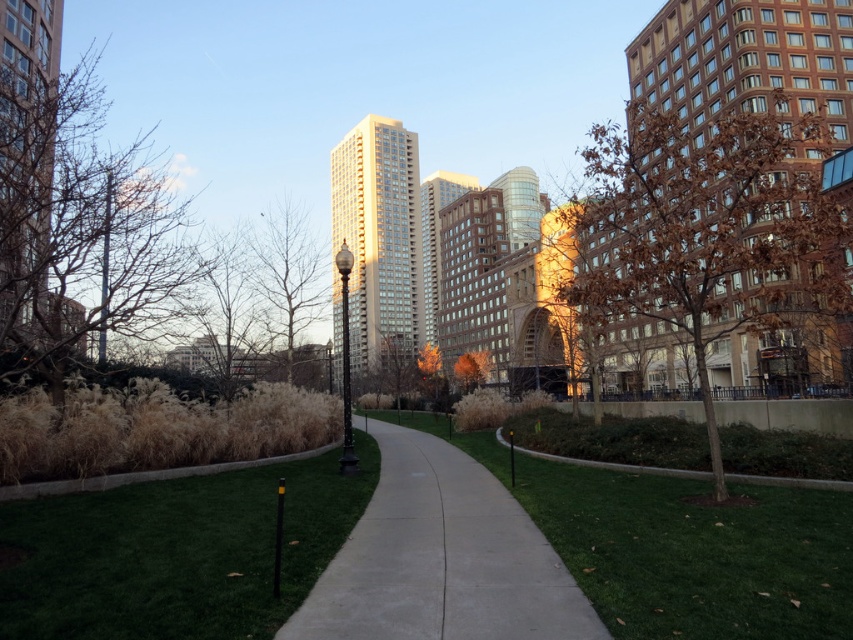
You are standing on the paved pathway in the park and see two points marked in the scene. Which point is closer to you, point (x=299, y=208) or point (x=473, y=387)?

Point (x=473, y=387) is closer to you because the description states that point (x=299, y=208) is behind point (x=473, y=387).

Based on the photo, you are a park maintenance worker who needs to prune the bare branches at left and the bare branches at center. Based on the scene, which of these two trees has a shorter height?

The bare branches at left has a lesser height compared to the bare branches at center, so the bare branches at left is shorter.

You are standing on the path and want to walk towards the green grass at center and the concrete at center. Which one will you step on first?

The green grass at center is closer to the viewer than the concrete at center, so you will step on the green grass at center first.